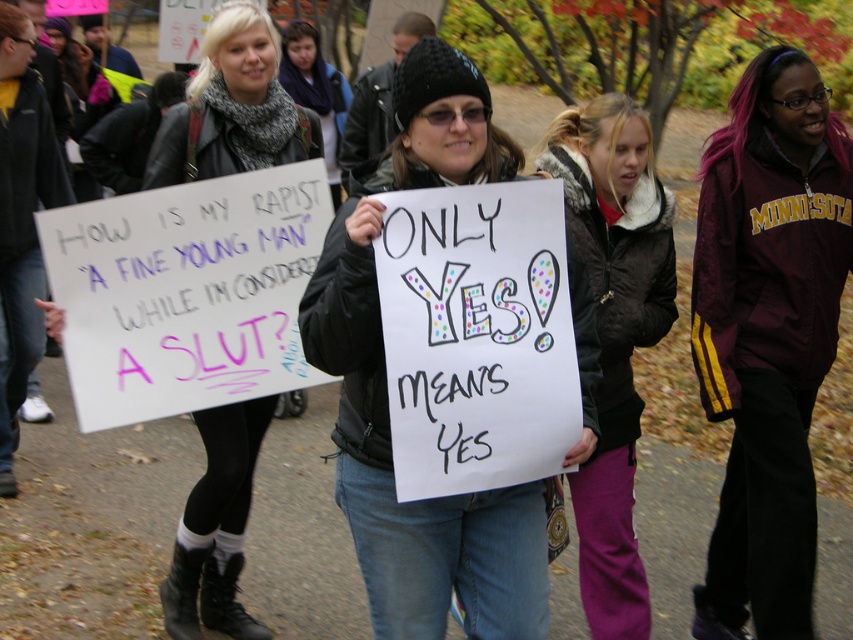
You are a photographer trying to capture a clear shot of the white paper sign at center and the maroon windbreaker at center. Based on their sizes, which object should you focus on first to ensure it fits within your camera frame?

The maroon windbreaker at center is taller than the white paper sign at center, so you should focus on capturing the maroon windbreaker at center first to ensure it fits within the camera frame.

You are a photographer standing at the edge of the protest. You want to take a closeup photo of the maroon windbreaker at center without moving closer. Can you zoom in enough to capture the details of the windbreaker clearly?

The maroon windbreaker at center is 2.98 meters away from the viewer. Depending on the camera lens, if it has sufficient zoom capability, you might be able to capture the details clearly from that distance. However, standard smartphone cameras may struggle with such zoom without causing blur.

You are a photographer trying to capture both the matte black jacket at center and the white paper sign at center in a single frame. Based on their sizes, do you think you can fit both into the camera view without zooming in? Explain your reasoning.

The matte black jacket at center might be wider than the white paper sign at center, so there is a possibility that the jacket occupies more space in the frame. However, since both are at the center, adjusting the camera angle slightly to ensure both are within the frame while maintaining their visibility should be feasible.